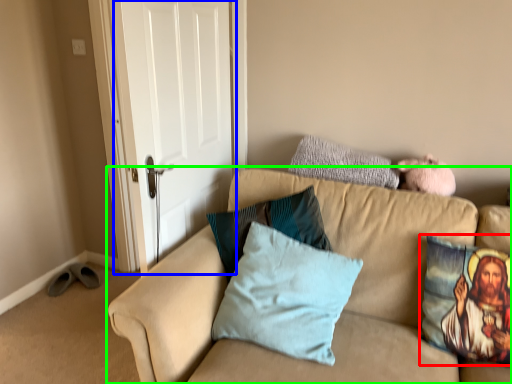
Question: Which object is the closest to the pillow (highlighted by a red box)? Choose among these: door (highlighted by a blue box) or studio couch (highlighted by a green box).

Choices:
 (A) door
 (B) studio couch

Answer: (B)